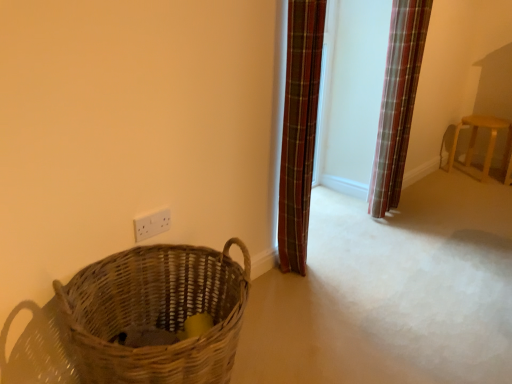
Question: Does white plastic electric outlet at lower left have a greater height compared to plaid fabric curtain at right, positioned as the second curtain in left-to-right order?

Choices:
 (A) no
 (B) yes

Answer: (A)

Question: Is white plastic electric outlet at lower left shorter than plaid fabric curtain at right, the first curtain when ordered from right to left?

Choices:
 (A) no
 (B) yes

Answer: (B)

Question: Can we say white plastic electric outlet at lower left lies outside plaid fabric curtain at right, positioned as the second curtain in left-to-right order?

Choices:
 (A) no
 (B) yes

Answer: (B)

Question: Does white plastic electric outlet at lower left appear on the left side of plaid fabric curtain at right, which appears as the first curtain when viewed from the back?

Choices:
 (A) no
 (B) yes

Answer: (B)

Question: Is white plastic electric outlet at lower left looking in the opposite direction of plaid fabric curtain at right, the first curtain when ordered from right to left?

Choices:
 (A) no
 (B) yes

Answer: (A)

Question: Is plaid fabric curtain at right, which ranks as the second curtain in front-to-back order, a part of white plastic electric outlet at lower left?

Choices:
 (A) yes
 (B) no

Answer: (B)

Question: Is plaid fabric curtain at center, positioned as the second curtain in right-to-left order, closer to camera compared to wooden stool at right?

Choices:
 (A) yes
 (B) no

Answer: (A)

Question: Is plaid fabric curtain at center, which is the second curtain in back-to-front order, taller than wooden stool at right?

Choices:
 (A) yes
 (B) no

Answer: (A)

Question: Is plaid fabric curtain at center, the 1th curtain positioned from the front, not inside wooden stool at right?

Choices:
 (A) yes
 (B) no

Answer: (A)

Question: Could you tell me if plaid fabric curtain at center, placed as the first curtain when sorted from left to right, is facing wooden stool at right?

Choices:
 (A) no
 (B) yes

Answer: (A)

Question: Can you confirm if plaid fabric curtain at center, the 1th curtain positioned from the front, is bigger than wooden stool at right?

Choices:
 (A) yes
 (B) no

Answer: (B)

Question: Is plaid fabric curtain at center, positioned as the second curtain in right-to-left order, at the left side of wooden stool at right?

Choices:
 (A) no
 (B) yes

Answer: (B)

Question: From a real-world perspective, is plaid fabric curtain at right, the first curtain when ordered from right to left, located beneath white plastic electric outlet at lower left?

Choices:
 (A) yes
 (B) no

Answer: (B)